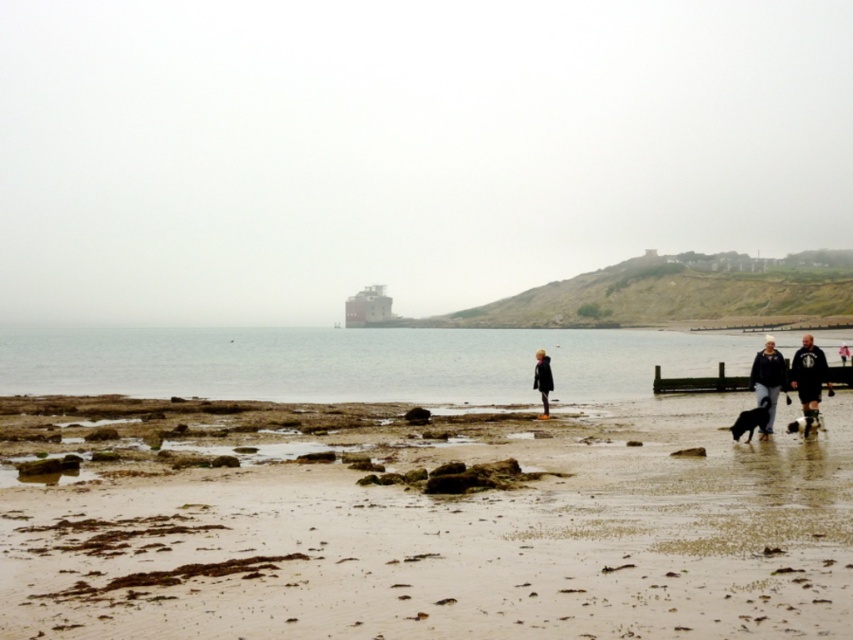
You are a photographer aiming to capture a landscape shot of the matte red building at center and the dark matte coat at center. Based on their sizes in the scene, which object would appear larger in your photo?

The matte red building at center appears larger in the photo because it has a greater height compared to the dark matte coat at center.

You are standing at the origin point of the image, which is the bottom left corner. You want to find the clear water at lower left. According to the coordinates provided, in which direction should you move to reach it?

The clear water at lower left is located at coordinates point (357, 362). Since the origin is at the bottom left corner, moving towards the right and slightly upwards would reach it.